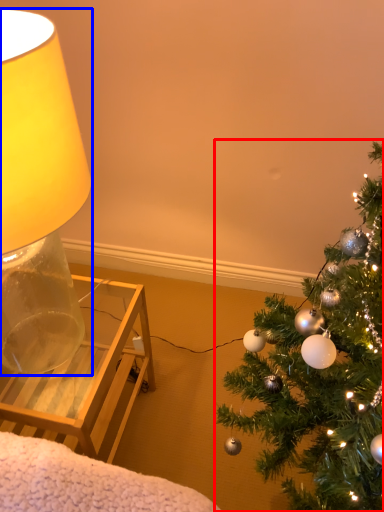
Question: Which point is further to the camera, christmas tree (highlighted by a red box) or lamp (highlighted by a blue box)?

Choices:
 (A) christmas tree
 (B) lamp

Answer: (B)